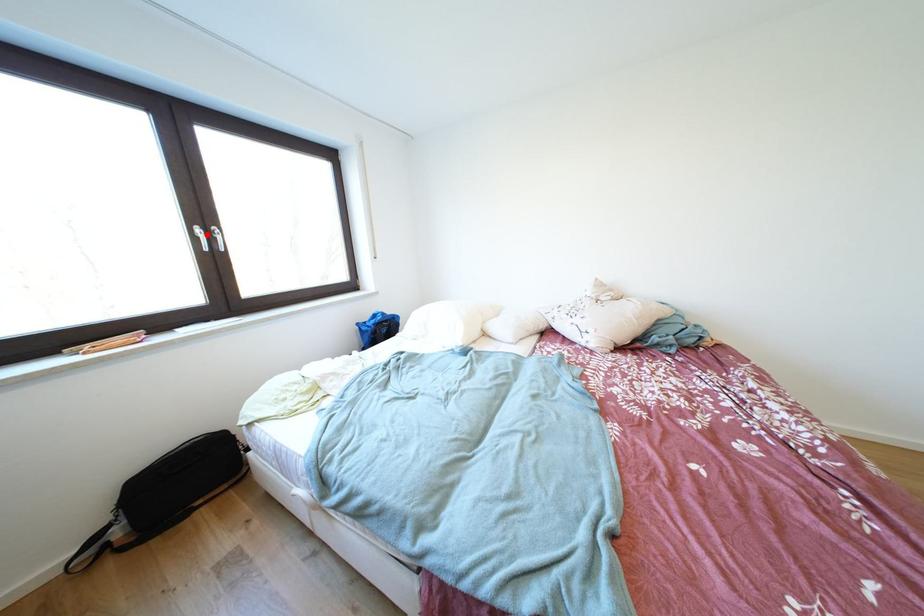
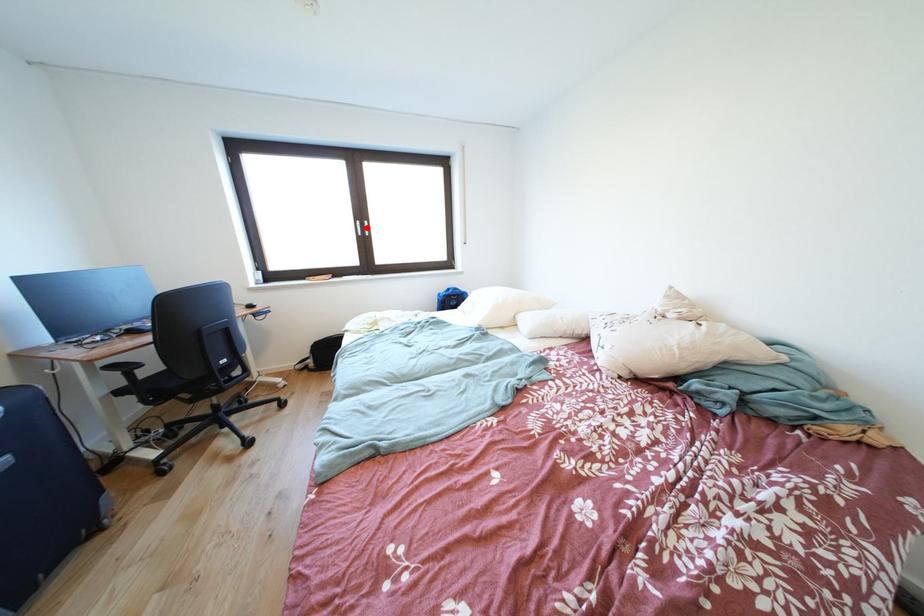
I am providing you with two images of the same scene from different viewpoints. A red point is marked on the first image and another point is marked on the second image. Are the points marked in image1 and image2 representing the same 3D position?

Yes